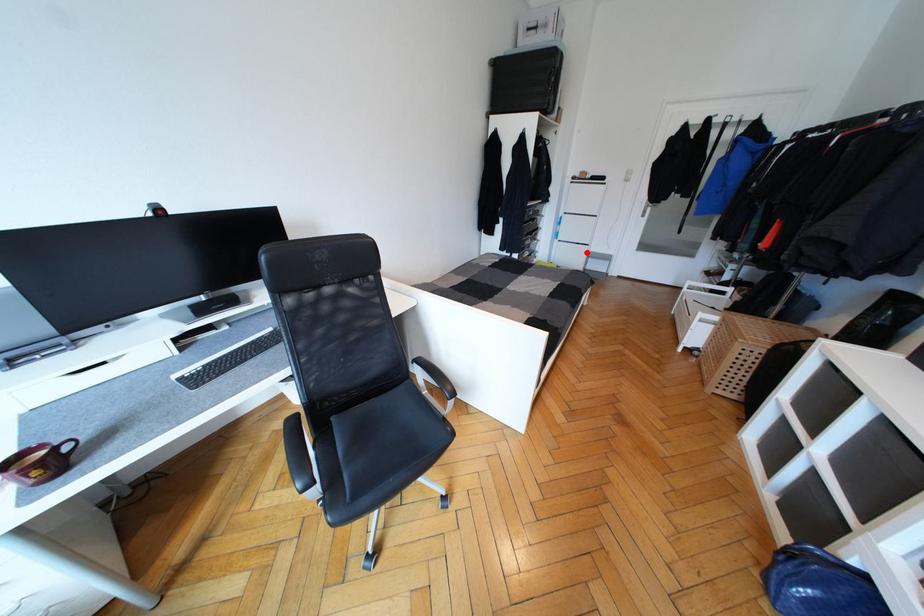
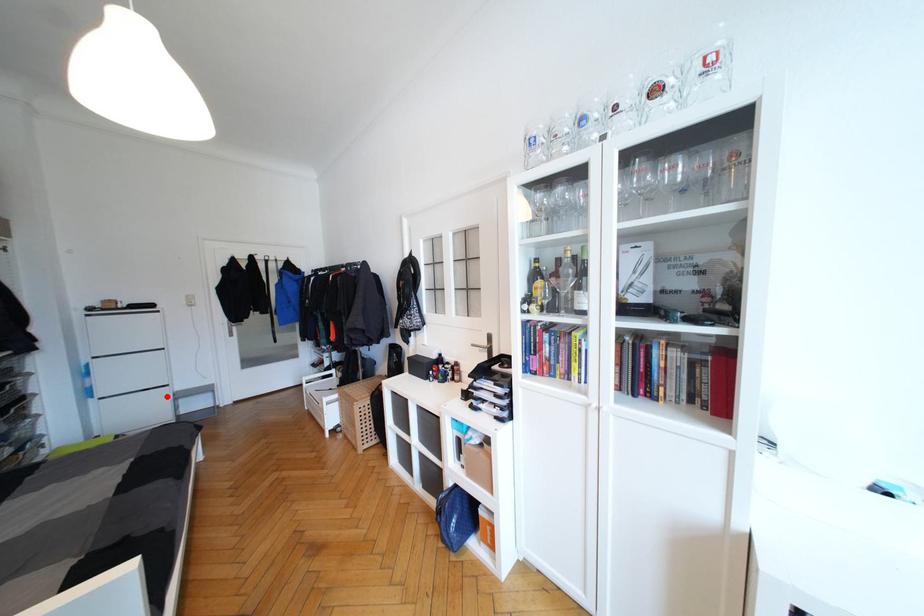
I am providing you with two images of the same scene from different viewpoints. A red point is marked on the first image and another point is marked on the second image. Is the marked point in image1 the same physical position as the marked point in image2?

Yes